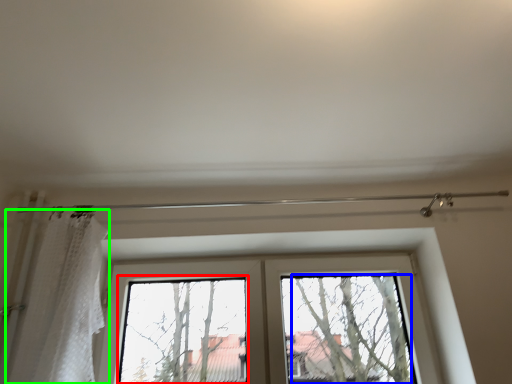
Question: Which is nearer to the bay window (highlighted by a red box)? tree (highlighted by a blue box) or shower curtain (highlighted by a green box).

Choices:
 (A) tree
 (B) shower curtain

Answer: (B)